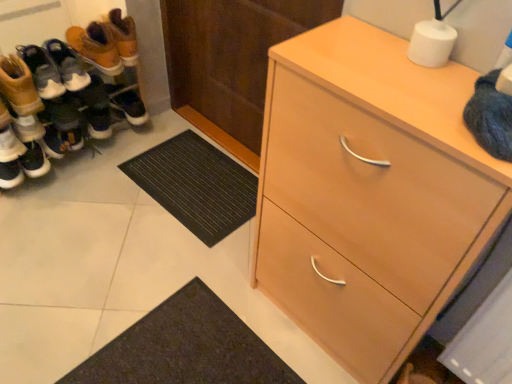
Question: Considering their positions, is wooden door at center located in front of or behind leather boots at left, the third footwear when ordered from back to front?

Choices:
 (A) front
 (B) behind

Answer: (A)

Question: Is wooden door at center spatially inside leather boots at left, the second footwear viewed from the front, or outside of it?

Choices:
 (A) inside
 (B) outside

Answer: (B)

Question: Estimate the real-world distances between objects in this image. Which object is farther from the wooden door at center?

Choices:
 (A) leather boots at left, the third footwear when ordered from back to front
 (B) light wood cabinet at right
 (C) leather boots at left, the first footwear positioned from the front
 (D) matte black shoes at left, the fourth footwear in the front-to-back sequence
 (E) matte white sneaker at left, which is counted as the second footwear, starting from the back

Answer: (E)

Question: Which is farther from the light wood cabinet at right?

Choices:
 (A) black rubber doormat at lower center
 (B) leather boots at left, which is counted as the fourth footwear, starting from the back
 (C) leather boots at left, the second footwear viewed from the front
 (D) wooden door at center
 (E) matte black shoes at left, the first footwear in the back-to-front sequence

Answer: (B)